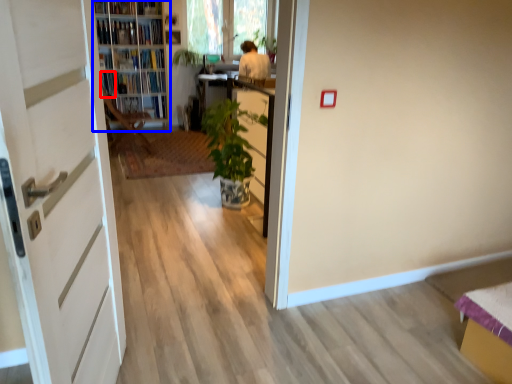
Question: Which point is closer to the camera, book (highlighted by a red box) or shelf (highlighted by a blue box)?

Choices:
 (A) book
 (B) shelf

Answer: (B)